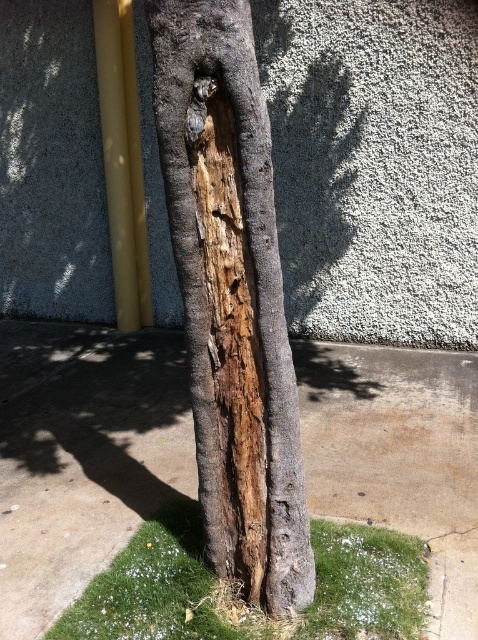
Question: Can you confirm if dark brown wood at center is thinner than green mossy grass at lower center?

Choices:
 (A) yes
 (B) no

Answer: (A)

Question: Which object is closer to the camera taking this photo?

Choices:
 (A) dark brown wood at center
 (B) brown concrete pavement at center
 (C) green mossy grass at lower center

Answer: (A)

Question: Can you confirm if brown concrete pavement at center is smaller than dark brown wood at center?

Choices:
 (A) yes
 (B) no

Answer: (B)

Question: Is the position of dark brown wood at center more distant than that of green mossy grass at lower center?

Choices:
 (A) no
 (B) yes

Answer: (A)

Question: Which of the following is the closest to the observer?

Choices:
 (A) (137, 589)
 (B) (87, 362)
 (C) (274, 362)

Answer: (C)

Question: Which of the following is the farthest from the observer?

Choices:
 (A) dark brown wood at center
 (B) brown concrete pavement at center
 (C) green mossy grass at lower center

Answer: (B)